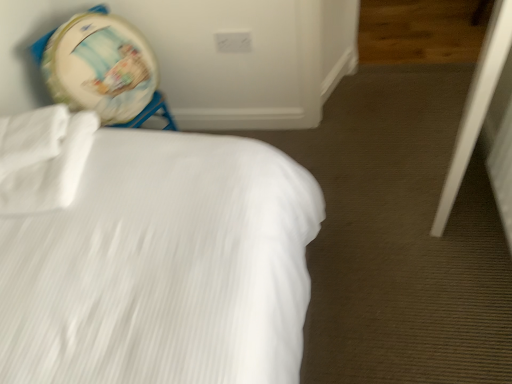
You are a GUI agent. You are given a task and a screenshot of the screen. Output one action in this format:
    pyautogui.click(x=<x>, y=<y>)
    Task: Click on the vacant space in front of white plastic screen door at lower right
    The image size is (512, 384).
    Given the screenshot: What is the action you would take?
    pyautogui.click(x=456, y=253)